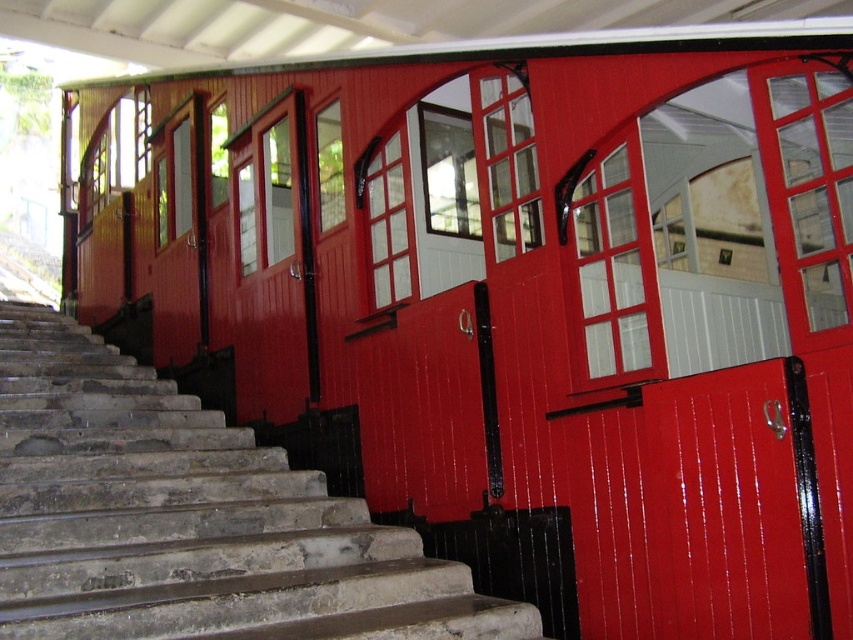
Who is higher up, stone stairs at lower left or glossy wood door at center?

glossy wood door at center is higher up.

Is stone stairs at lower left wider than glossy wood door at center?

Yes.

Does point (292, 596) lie behind point (735, 518)?

Yes.

Locate an element on the screen. This screenshot has width=853, height=640. stone stairs at lower left is located at coordinates pos(189,518).